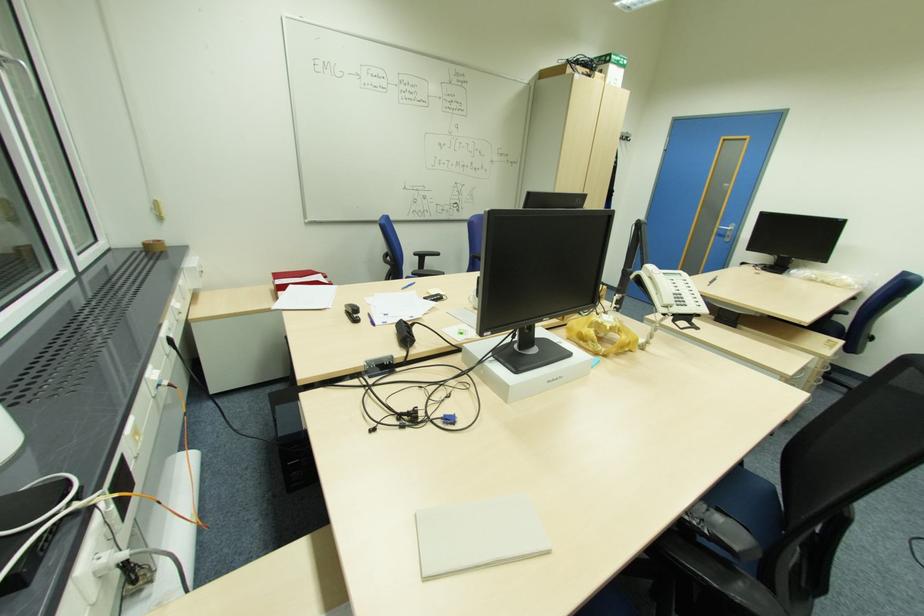
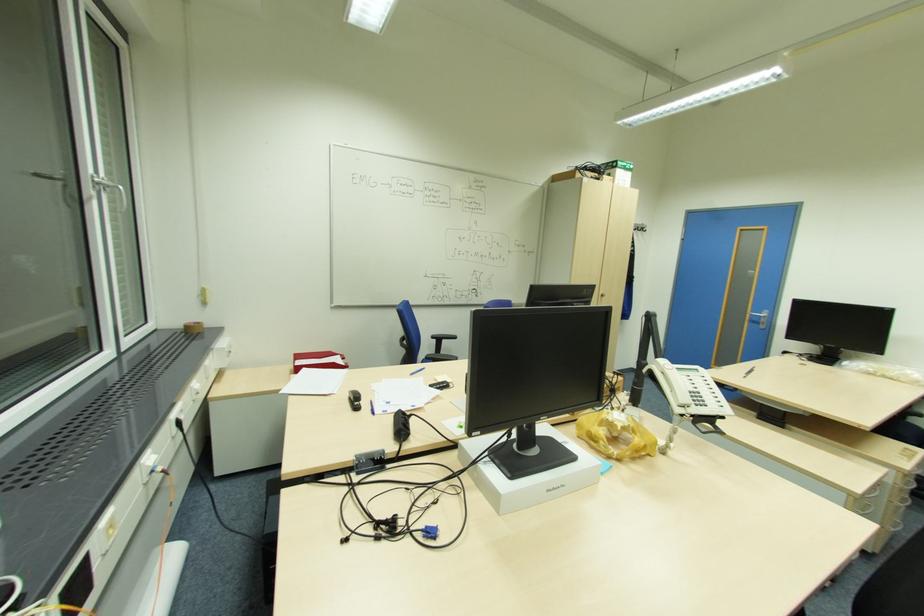
Find the pixel in the second image that matches (x=732, y=236) in the first image.

(766, 323)